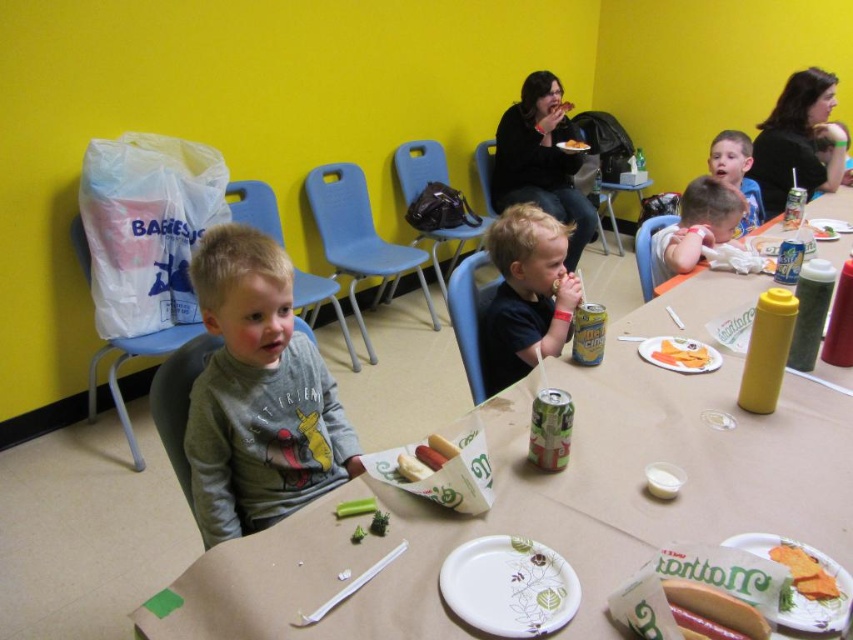
Can you confirm if smooth skin boy at center is smaller than yellow matte carrot at center?

Incorrect, smooth skin boy at center is not smaller in size than yellow matte carrot at center.

Is smooth skin boy at center to the right of yellow matte carrot at center from the viewer's perspective?

Indeed, smooth skin boy at center is positioned on the right side of yellow matte carrot at center.

This screenshot has width=853, height=640. In order to click on smooth skin boy at center in this screenshot , I will do `click(695, 227)`.

Does smooth blue shirt at center lie in front of brown paper plate at center?

That is True.

Which is more to the left, smooth blue shirt at center or brown paper plate at center?

smooth blue shirt at center

Identify the location of smooth blue shirt at center. (735, 173).

What do you see at coordinates (425, 458) in the screenshot? I see `white paper hot dog at center` at bounding box center [425, 458].

From the picture: Is white paper hot dog at center in front of white paper bag at center?

That is True.

Image resolution: width=853 pixels, height=640 pixels. What are the coordinates of `white paper hot dog at center` in the screenshot? It's located at (425, 458).

Find the location of a particular element. The height and width of the screenshot is (640, 853). white paper hot dog at center is located at coordinates (425, 458).